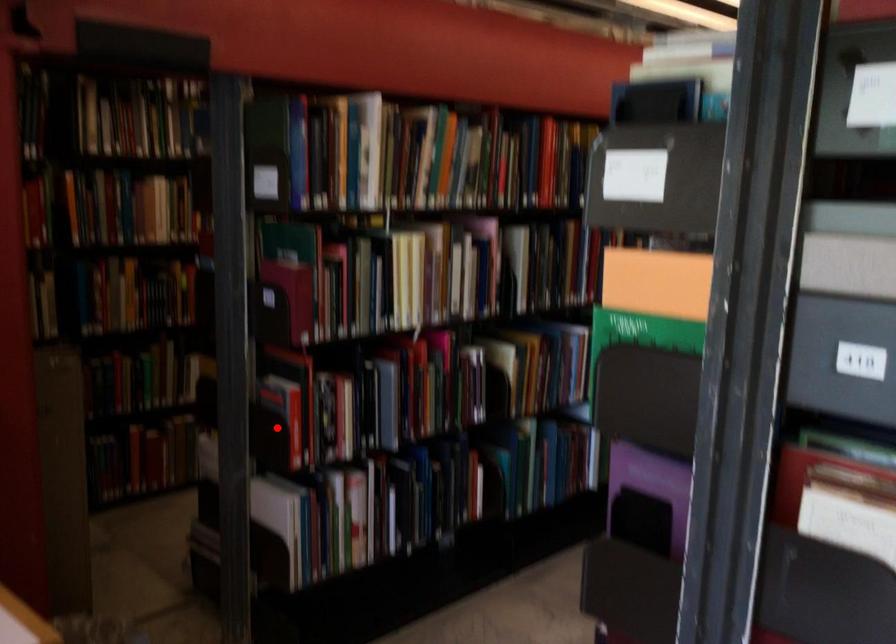
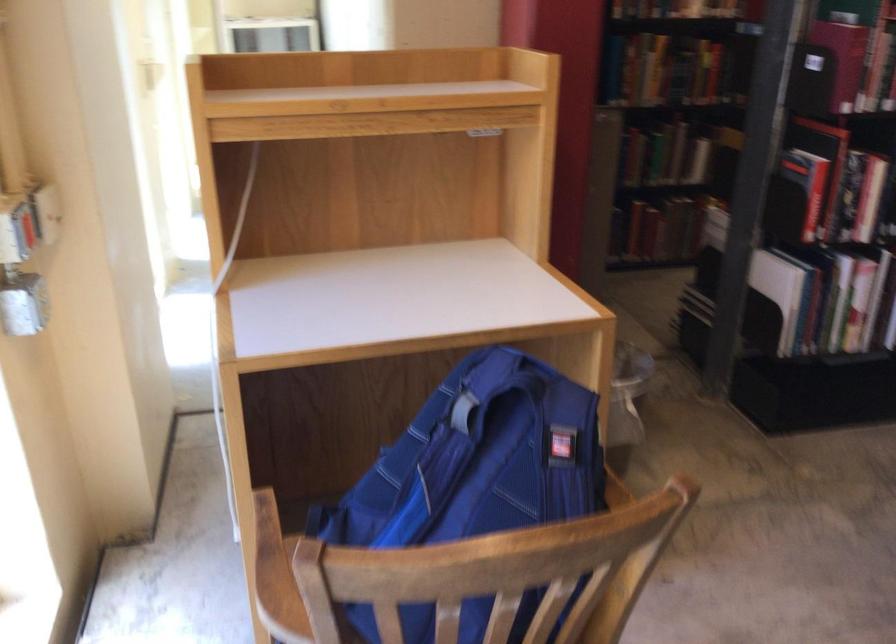
Where in the second image is the point corresponding to the highlighted location from the first image?

(806, 185)